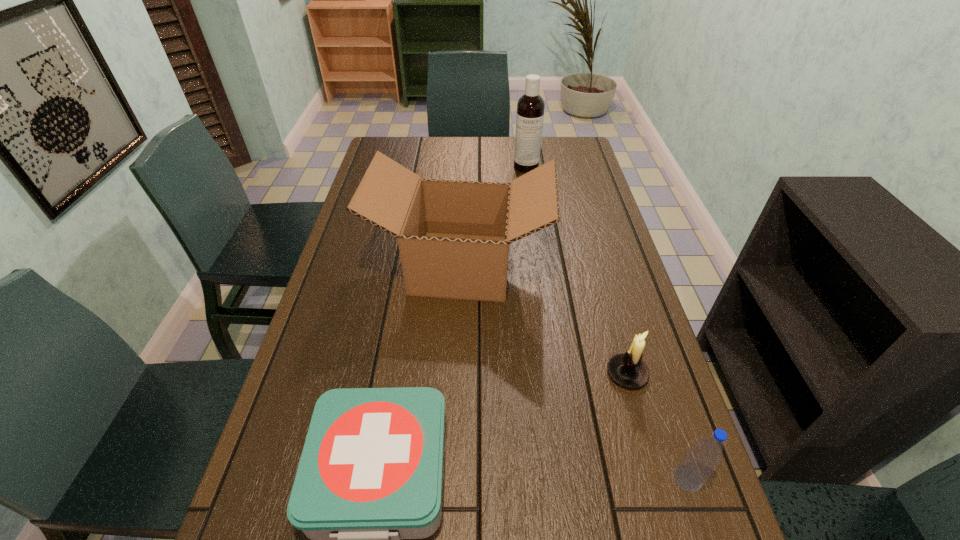
Find the location of a particular element. Image resolution: width=960 pixels, height=540 pixels. vacant space that's between the box and the second shortest object is located at coordinates (544, 320).

You are a GUI agent. You are given a task and a screenshot of the screen. Output one action in this format:
    pyautogui.click(x=<x>, y=<y>)
    Task: Click on the vacant point located between the fourth nearest object and the fourth tallest object
    Image resolution: width=960 pixels, height=540 pixels.
    Given the screenshot: What is the action you would take?
    pyautogui.click(x=544, y=320)

Find the location of `empty location between the farthest object and the water bottle`. empty location between the farthest object and the water bottle is located at coordinates (607, 322).

Locate an element on the screen. The image size is (960, 540). vacant area that lies between the candle holder and the water bottle is located at coordinates (658, 426).

The height and width of the screenshot is (540, 960). Identify the location of free space between the water bottle and the second tallest object. (575, 372).

Find the location of a particular element. Image resolution: width=960 pixels, height=540 pixels. object that ranks as the second closest to the shortest object is located at coordinates (627, 369).

The height and width of the screenshot is (540, 960). I want to click on object that stands as the fourth closest to the water bottle, so click(530, 108).

Locate an element on the screen. This screenshot has height=540, width=960. vacant area that satisfies the following two spatial constraints: 1. on the front side of the water bottle; 2. on the left side of the candle holder is located at coordinates (657, 478).

This screenshot has width=960, height=540. Find the location of `vacant point that satisfies the following two spatial constraints: 1. on the front side of the fourth nearest object; 2. on the left side of the water bottle`. vacant point that satisfies the following two spatial constraints: 1. on the front side of the fourth nearest object; 2. on the left side of the water bottle is located at coordinates (452, 478).

Where is `vacant space that satisfies the following two spatial constraints: 1. on the front side of the candle holder; 2. on the left side of the fourth nearest object`? vacant space that satisfies the following two spatial constraints: 1. on the front side of the candle holder; 2. on the left side of the fourth nearest object is located at coordinates (457, 374).